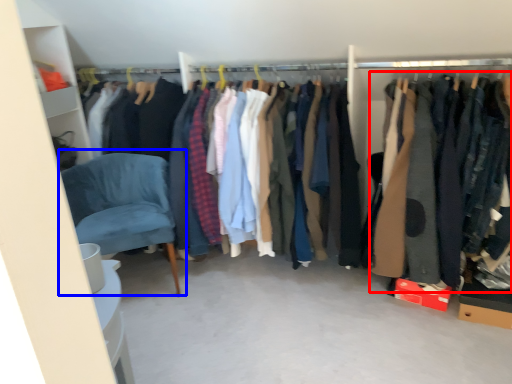
Question: Which point is closer to the camera, clothing (highlighted by a red box) or chair (highlighted by a blue box)?

Choices:
 (A) clothing
 (B) chair

Answer: (A)